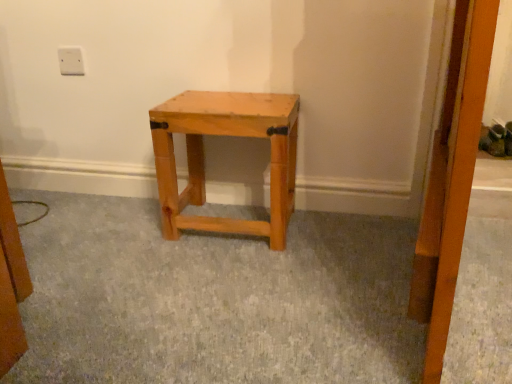
Question: Is natural wood stool at center taller or shorter than white plastic outlet at upper left?

Choices:
 (A) tall
 (B) short

Answer: (A)

Question: Which is correct: natural wood stool at center is inside white plastic outlet at upper left, or outside of it?

Choices:
 (A) outside
 (B) inside

Answer: (A)

Question: In the image, is natural wood stool at center on the left side or the right side of white plastic outlet at upper left?

Choices:
 (A) left
 (B) right

Answer: (B)

Question: Considering the positions of white plastic outlet at upper left and natural wood stool at center in the image, is white plastic outlet at upper left taller or shorter than natural wood stool at center?

Choices:
 (A) tall
 (B) short

Answer: (B)

Question: Considering their positions, is white plastic outlet at upper left located in front of or behind natural wood stool at center?

Choices:
 (A) front
 (B) behind

Answer: (B)

Question: In the image, is white plastic outlet at upper left on the left side or the right side of natural wood stool at center?

Choices:
 (A) right
 (B) left

Answer: (B)

Question: From a real-world perspective, relative to natural wood stool at center, is white plastic outlet at upper left vertically above or below?

Choices:
 (A) below
 (B) above

Answer: (B)